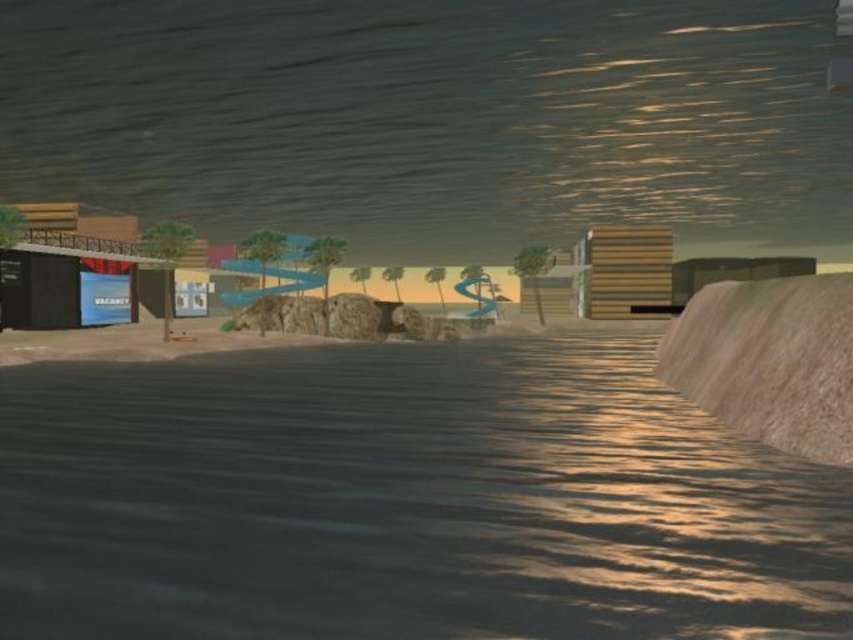
You are standing at the edge of the beach and see the rustic wood ramp at right and the blue glossy sign at lower left. Which object is wider?

The rustic wood ramp at right is wider than the blue glossy sign at lower left.

In the scene shown: You are a delivery drone that needs to land on the blue glossy sign at lower left. However, there is a rustic wood ramp at right in the way. Can you safely land on the sign without hitting the ramp?

The rustic wood ramp at right is positioned on the right side of the blue glossy sign at lower left. Since the ramp is to the right of the sign, the drone can safely land on the blue glossy sign at lower left as long as it approaches from the left side, avoiding the ramp.

You are standing on the beach in the twilight scene and need to reach the blue glossy sign at lower left. There is a rustic wood ramp at right nearby. Considering their sizes, which object would be easier to step onto from the ground?

The rustic wood ramp at right has a larger size compared to the blue glossy sign at lower left, so it would be easier to step onto because of its bigger surface area.